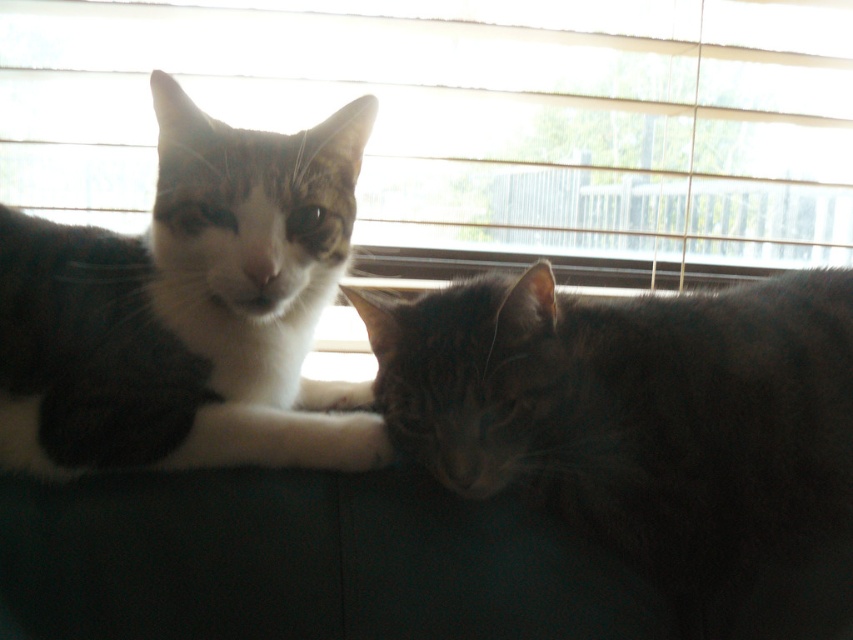
Does dark gray fur cat at center have a smaller size compared to white fur cat at left?

Actually, dark gray fur cat at center might be larger than white fur cat at left.

Measure the distance between dark gray fur cat at center and camera.

dark gray fur cat at center is 96.78 centimeters away from camera.

Measure the distance between dark gray fur cat at center and camera.

They are 38.10 inches apart.

Where is `dark gray fur cat at center`? This screenshot has width=853, height=640. dark gray fur cat at center is located at coordinates (635, 416).

Is white wood blinds at upper center wider than dark gray fur cat at center?

Correct, the width of white wood blinds at upper center exceeds that of dark gray fur cat at center.

Who is higher up, white wood blinds at upper center or dark gray fur cat at center?

Positioned higher is white wood blinds at upper center.

Who is more forward, (x=532, y=252) or (x=746, y=532)?

Point (x=746, y=532) is in front.

Identify the location of white wood blinds at upper center. This screenshot has height=640, width=853. (473, 122).

How far apart are white wood blinds at upper center and white fur cat at left?

A distance of 30.76 inches exists between white wood blinds at upper center and white fur cat at left.

Who is more distant from viewer, (x=103, y=179) or (x=248, y=410)?

Point (x=103, y=179)

In order to click on white wood blinds at upper center in this screenshot , I will do `click(473, 122)`.